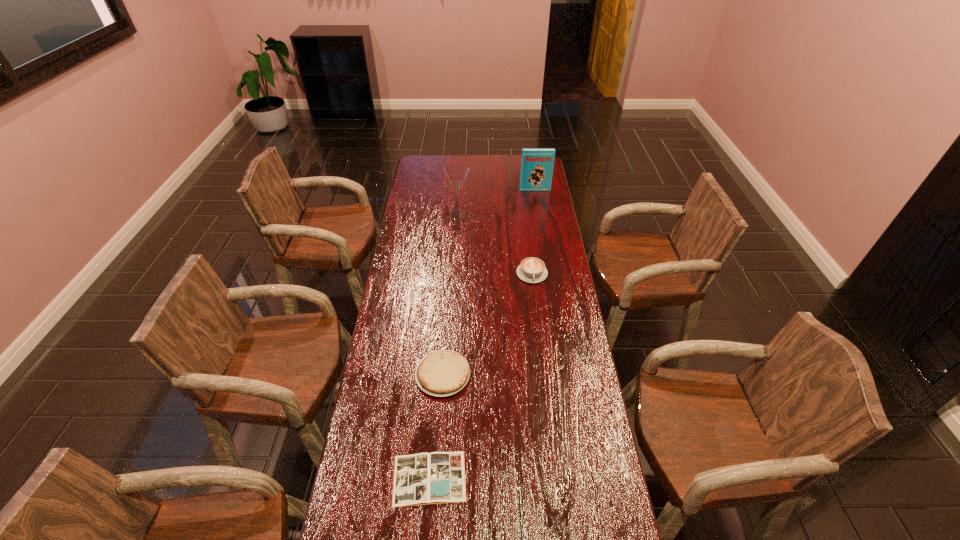
What are the coordinates of `vacant area situated 0.050m on the front cover of the right book` in the screenshot? It's located at (536, 197).

This screenshot has width=960, height=540. I want to click on free space located on the side of the third tallest object with the handle, so click(x=536, y=303).

In order to click on blank area located on the right of the second shortest object in this screenshot , I will do `click(512, 374)`.

Identify the location of free location located 0.300m on the back of the nearest object. This screenshot has width=960, height=540. (439, 367).

Locate an element on the screen. This screenshot has width=960, height=540. tortilla that is at the left edge is located at coordinates (441, 373).

Locate an element on the screen. The height and width of the screenshot is (540, 960). book positioned at the left edge is located at coordinates (438, 477).

Locate an element on the screen. book that is at the right edge is located at coordinates (537, 164).

Locate an element on the screen. cappuccino that is at the right edge is located at coordinates (532, 270).

Find the location of a particular element. free region at the far edge of the desktop is located at coordinates (491, 160).

The height and width of the screenshot is (540, 960). What are the coordinates of `vacant space at the left edge of the desktop` in the screenshot? It's located at pos(436,210).